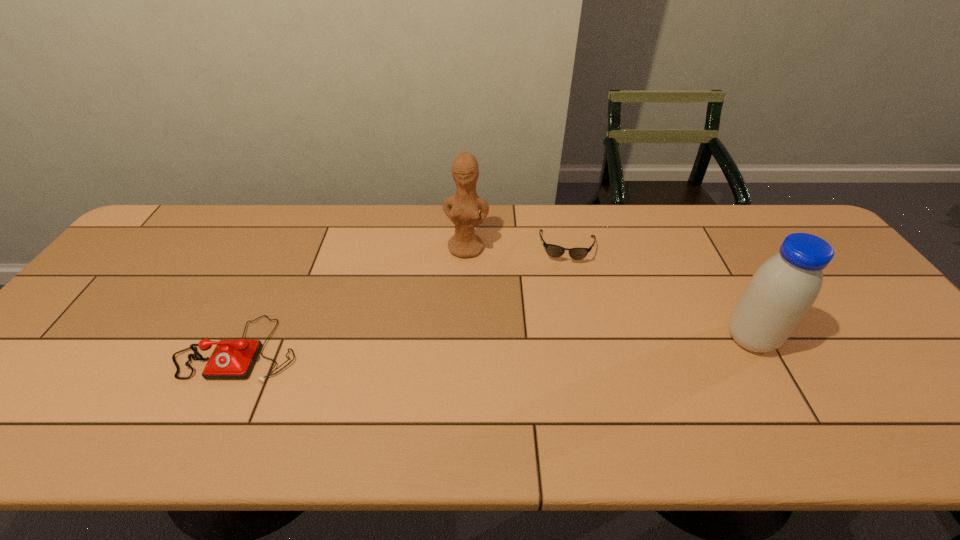
Image resolution: width=960 pixels, height=540 pixels. I want to click on free space on the desktop that is between the second shortest object and the soya milk and is positioned on the front-facing side of the shortest object, so click(x=562, y=342).

Locate an element on the screen. The image size is (960, 540). vacant space on the desktop that is between the leftmost object and the soya milk and is positioned on the front-facing side of the figurine is located at coordinates (448, 345).